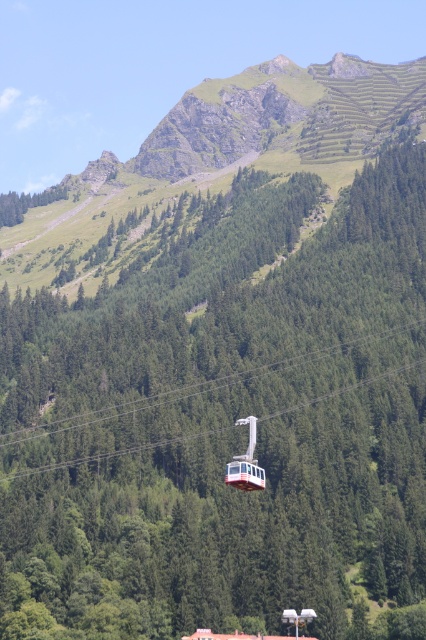
Can you confirm if green grassy mountain at upper center is bigger than metallic cable car at center?

Indeed, green grassy mountain at upper center has a larger size compared to metallic cable car at center.

How much distance is there between green grassy mountain at upper center and metallic cable car at center?

green grassy mountain at upper center and metallic cable car at center are 257.18 meters apart from each other.

Is point (221, 90) in front of point (244, 476)?

No.

The image size is (426, 640). Identify the location of green grassy mountain at upper center. (216, 157).

Who is higher up, green leafy tree at upper left or metallic cable car at center?

Positioned higher is green leafy tree at upper left.

Can you confirm if green leafy tree at upper left is smaller than metallic cable car at center?

Incorrect, green leafy tree at upper left is not smaller in size than metallic cable car at center.

What do you see at coordinates (26, 202) in the screenshot? The image size is (426, 640). I see `green leafy tree at upper left` at bounding box center [26, 202].

You are a GUI agent. You are given a task and a screenshot of the screen. Output one action in this format:
    pyautogui.click(x=<x>, y=<y>)
    Task: Click on the green leafy tree at upper left
    The height and width of the screenshot is (640, 426).
    Given the screenshot: What is the action you would take?
    pyautogui.click(x=26, y=202)

Does green grassy mountain at upper center have a greater height compared to white glossy cable car at center?

Yes, green grassy mountain at upper center is taller than white glossy cable car at center.

Does green grassy mountain at upper center have a larger size compared to white glossy cable car at center?

Correct, green grassy mountain at upper center is larger in size than white glossy cable car at center.

Where is `green grassy mountain at upper center`? The image size is (426, 640). green grassy mountain at upper center is located at coordinates (216, 157).

At what (x,y) coordinates should I click in order to perform the action: click on green grassy mountain at upper center. Please return your answer as a coordinate pair (x, y). The width and height of the screenshot is (426, 640). Looking at the image, I should click on (216, 157).